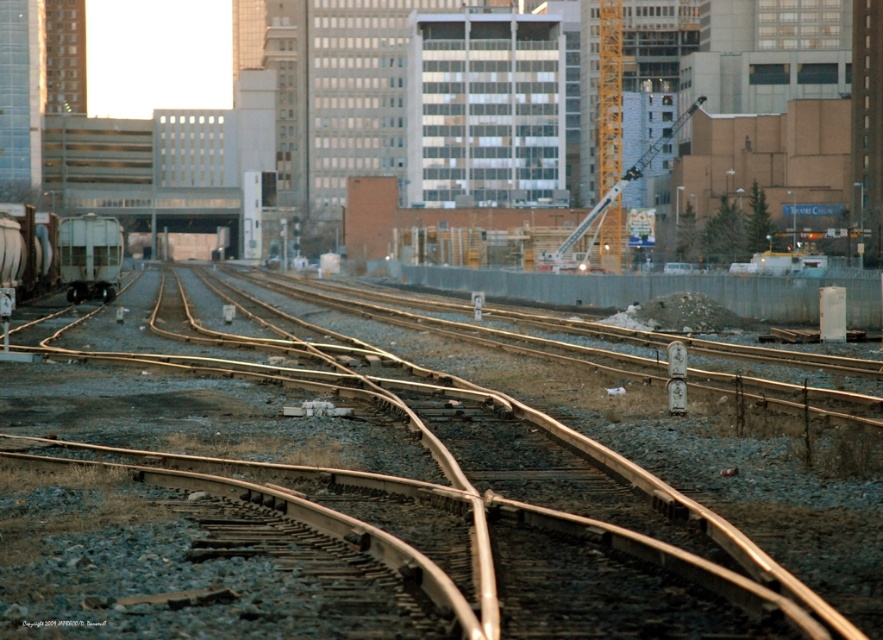
Which of these two, gray matte train car at left or yellow metallic crane at upper center, stands taller?

yellow metallic crane at upper center is taller.

Based on the photo, does gray matte train car at left have a smaller size compared to yellow metallic crane at upper center?

Yes, gray matte train car at left is smaller than yellow metallic crane at upper center.

Which is in front, point (94, 230) or point (627, 170)?

Point (94, 230) is in front.

Find the location of a particular element. gray matte train car at left is located at coordinates (69, 252).

Based on the photo, can you confirm if metallic brown tracks at center is positioned to the right of yellow metallic crane at upper center?

In fact, metallic brown tracks at center is to the left of yellow metallic crane at upper center.

Which is more to the right, metallic brown tracks at center or yellow metallic crane at upper center?

yellow metallic crane at upper center is more to the right.

What do you see at coordinates (349, 497) in the screenshot?
I see `metallic brown tracks at center` at bounding box center [349, 497].

This screenshot has height=640, width=883. I want to click on metallic brown tracks at center, so click(x=349, y=497).

Can you confirm if metallic brown tracks at center is positioned below matte silver train car at left?

Indeed, metallic brown tracks at center is positioned under matte silver train car at left.

Does metallic brown tracks at center have a lesser width compared to matte silver train car at left?

No, metallic brown tracks at center is not thinner than matte silver train car at left.

Does point (117, 508) come behind point (110, 260)?

No, it is in front of (110, 260).

In order to click on metallic brown tracks at center in this screenshot , I will do `click(349, 497)`.